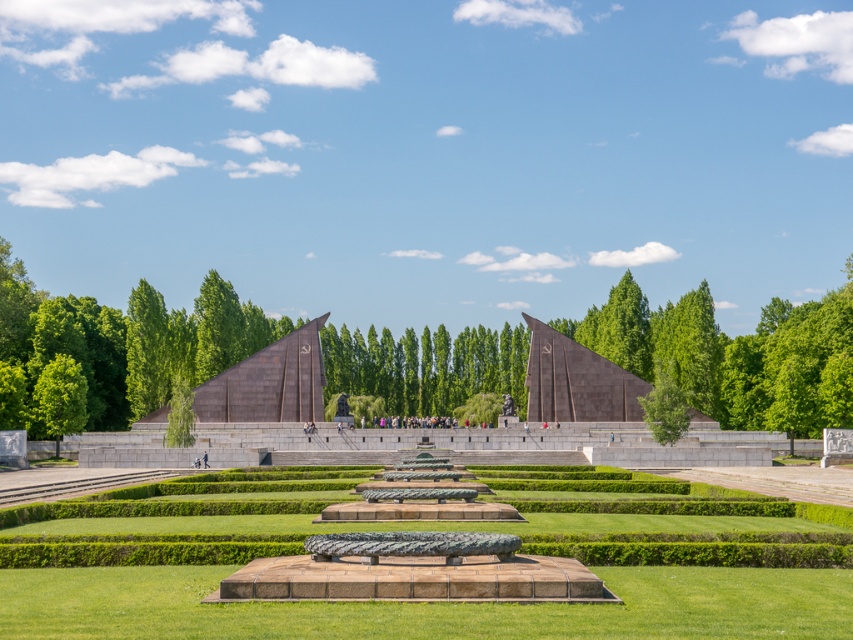
Between green leafy trees at center and green leafy tree at lower left, which one appears on the right side from the viewer's perspective?

From the viewer's perspective, green leafy trees at center appears more on the right side.

Looking at this image, does green leafy trees at center appear on the right side of green leafy tree at lower left?

Indeed, green leafy trees at center is positioned on the right side of green leafy tree at lower left.

Locate an element on the screen. This screenshot has height=640, width=853. green leafy trees at center is located at coordinates (426, 365).

You are a GUI agent. You are given a task and a screenshot of the screen. Output one action in this format:
    pyautogui.click(x=<x>, y=<y>)
    Task: Click on the green leafy trees at center
    The height and width of the screenshot is (640, 853).
    Given the screenshot: What is the action you would take?
    pyautogui.click(x=426, y=365)

Between green grass at center and green leafy tree at center, which one has less height?

green grass at center is shorter.

Describe the element at coordinates (432, 604) in the screenshot. I see `green grass at center` at that location.

The image size is (853, 640). I want to click on green grass at center, so click(432, 604).

At what (x,y) coordinates should I click in order to perform the action: click on green grass at center. Please return your answer as a coordinate pair (x, y). The height and width of the screenshot is (640, 853). Looking at the image, I should click on (432, 604).

Can you confirm if green leafy tree at center is thinner than green leafy tree at lower left?

No.

Does point (694, 355) come farther from viewer compared to point (61, 412)?

That is True.

At what (x,y) coordinates should I click in order to perform the action: click on green leafy tree at center. Please return your answer as a coordinate pair (x, y). The width and height of the screenshot is (853, 640). Looking at the image, I should click on (734, 355).